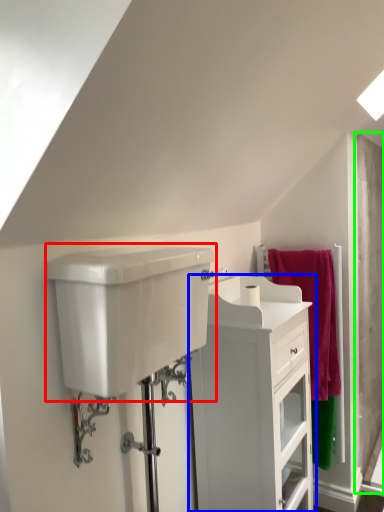
Question: Based on their relative distances, which object is nearer to sink (highlighted by a red box)? Choose from bathroom cabinet (highlighted by a blue box) and screen door (highlighted by a green box).

Choices:
 (A) bathroom cabinet
 (B) screen door

Answer: (A)